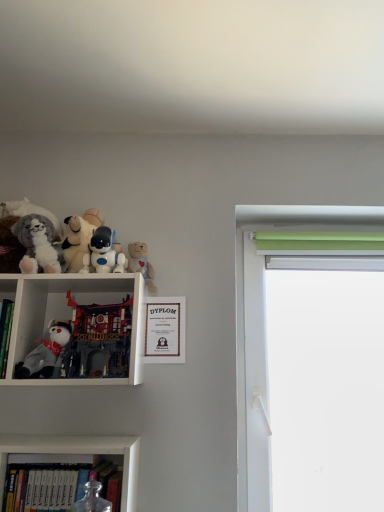
The height and width of the screenshot is (512, 384). What do you see at coordinates (45, 352) in the screenshot?
I see `white plush toy at left, the second toy positioned from the left` at bounding box center [45, 352].

Locate an element on the screen. white matte robot at upper left, arranged as the fifth toy when viewed from the left is located at coordinates (103, 253).

Describe the element at coordinates (141, 264) in the screenshot. This screenshot has width=384, height=512. I see `white plush bear at upper center, positioned as the sixth toy in left-to-right order` at that location.

This screenshot has height=512, width=384. What do you see at coordinates (98, 340) in the screenshot?
I see `matte red and black castle at left, which appears as the 4th toy when viewed from the left` at bounding box center [98, 340].

This screenshot has height=512, width=384. Identify the location of matte red and black castle at left, which appears as the 4th toy when viewed from the left. (98, 340).

Locate an element on the screen. This screenshot has height=512, width=384. fluffy plush cat at left, which appears as the 1th toy when viewed from the left is located at coordinates 39,245.

In terms of width, does white plush toy at left, the second toy positioned from the left, look wider or thinner when compared to white matte robot at upper left, the 2th toy in the right-to-left sequence?

In the image, white plush toy at left, the second toy positioned from the left, appears to be wider than white matte robot at upper left, the 2th toy in the right-to-left sequence.

Is white plush toy at left, which is the fifth toy from right to left, oriented towards white matte robot at upper left, arranged as the fifth toy when viewed from the left?

No, white plush toy at left, which is the fifth toy from right to left, is not turned towards white matte robot at upper left, arranged as the fifth toy when viewed from the left.

From a real-world perspective, is white plush toy at left, the second toy positioned from the left, under white matte robot at upper left, the 2th toy in the right-to-left sequence?

Indeed, from a real-world perspective, white plush toy at left, the second toy positioned from the left, is positioned beneath white matte robot at upper left, the 2th toy in the right-to-left sequence.

Can you confirm if white plush toy at left, the second toy positioned from the left, is smaller than white matte robot at upper left, the 2th toy in the right-to-left sequence?

Actually, white plush toy at left, the second toy positioned from the left, might be larger than white matte robot at upper left, the 2th toy in the right-to-left sequence.

Is matte gold picture frame at center outside of white plush toy at left, acting as the third toy starting from the left?

Yes, matte gold picture frame at center is located beyond the bounds of white plush toy at left, acting as the third toy starting from the left.

Is matte gold picture frame at center beside white plush toy at left, which appears as the fourth toy when viewed from the right?

They are not placed beside each other.

Is matte gold picture frame at center smaller than white plush toy at left, which appears as the fourth toy when viewed from the right?

Yes, matte gold picture frame at center is smaller than white plush toy at left, which appears as the fourth toy when viewed from the right.

Does matte gold picture frame at center have a greater height compared to white plush toy at left, which appears as the fourth toy when viewed from the right?

No, matte gold picture frame at center is not taller than white plush toy at left, which appears as the fourth toy when viewed from the right.

Which object is further away from the camera taking this photo, white plush toy at left, acting as the third toy starting from the left, or matte gold picture frame at center?

Positioned behind is matte gold picture frame at center.

Where is `picture frame below the white plush toy at left, acting as the third toy starting from the left (from a real-world perspective)`? Image resolution: width=384 pixels, height=512 pixels. picture frame below the white plush toy at left, acting as the third toy starting from the left (from a real-world perspective) is located at coordinates (165, 330).

From a real-world perspective, is white plush toy at left, acting as the third toy starting from the left, physically above matte gold picture frame at center?

Yes, from a real-world perspective, white plush toy at left, acting as the third toy starting from the left, is on top of matte gold picture frame at center.

Where is `the 1st toy to the right when counting from the white matte bookcase at left, the 2th bookcase when ordered from bottom to top`? This screenshot has width=384, height=512. the 1st toy to the right when counting from the white matte bookcase at left, the 2th bookcase when ordered from bottom to top is located at coordinates (79, 238).

Is white plush toy at left, acting as the third toy starting from the left, aimed at white matte bookcase at left, the 2th bookcase when ordered from bottom to top?

No, white plush toy at left, acting as the third toy starting from the left, is not oriented towards white matte bookcase at left, the 2th bookcase when ordered from bottom to top.

Between white plush toy at left, acting as the third toy starting from the left, and white matte bookcase at left, the 2th bookcase when ordered from bottom to top, which one has larger width?

With larger width is white matte bookcase at left, the 2th bookcase when ordered from bottom to top.

Does white plush toy at left, which appears as the fourth toy when viewed from the right, appear on the left side of white matte bookcase at left, the 2th bookcase when ordered from bottom to top?

In fact, white plush toy at left, which appears as the fourth toy when viewed from the right, is to the right of white matte bookcase at left, the 2th bookcase when ordered from bottom to top.

Would you consider matte gold picture frame at center to be distant from matte red and black castle at left, acting as the third toy starting from the right?

No, there isn't a large distance between matte gold picture frame at center and matte red and black castle at left, acting as the third toy starting from the right.

Consider the image. In terms of width, does matte gold picture frame at center look wider or thinner when compared to matte red and black castle at left, acting as the third toy starting from the right?

Clearly, matte gold picture frame at center has less width compared to matte red and black castle at left, acting as the third toy starting from the right.

Consider the image. Could you tell me if matte gold picture frame at center is turned towards matte red and black castle at left, which appears as the 4th toy when viewed from the left?

No, matte gold picture frame at center is not aimed at matte red and black castle at left, which appears as the 4th toy when viewed from the left.

At what (x,y) coordinates should I click in order to perform the action: click on toy that is the 1st object directly below the matte gold picture frame at center (from a real-world perspective). Please return your answer as a coordinate pair (x, y). Looking at the image, I should click on (98, 340).

Is hardcover books at lower left, placed as the first bookcase when sorted from bottom to top, oriented towards white plush toy at left, which is the fifth toy from right to left?

No, hardcover books at lower left, placed as the first bookcase when sorted from bottom to top, does not turn towards white plush toy at left, which is the fifth toy from right to left.

Which is behind, hardcover books at lower left, placed as the first bookcase when sorted from bottom to top, or white plush toy at left, which is the fifth toy from right to left?

white plush toy at left, which is the fifth toy from right to left, is behind.

From the picture: Considering the sizes of objects hardcover books at lower left, the 2th bookcase in the top-to-bottom sequence, and white plush toy at left, which is the fifth toy from right to left, in the image provided, who is bigger, hardcover books at lower left, the 2th bookcase in the top-to-bottom sequence, or white plush toy at left, which is the fifth toy from right to left,?

A: hardcover books at lower left, the 2th bookcase in the top-to-bottom sequence, is bigger.

Is hardcover books at lower left, the 2th bookcase in the top-to-bottom sequence, shorter than white plush toy at left, the second toy positioned from the left?

In fact, hardcover books at lower left, the 2th bookcase in the top-to-bottom sequence, may be taller than white plush toy at left, the second toy positioned from the left.

Considering the sizes of white plush bear at upper center, positioned as the sixth toy in left-to-right order, and hardcover books at lower left, the 2th bookcase in the top-to-bottom sequence, in the image, is white plush bear at upper center, positioned as the sixth toy in left-to-right order, wider or thinner than hardcover books at lower left, the 2th bookcase in the top-to-bottom sequence,?

Clearly, white plush bear at upper center, positioned as the sixth toy in left-to-right order, has less width compared to hardcover books at lower left, the 2th bookcase in the top-to-bottom sequence.

Between white plush bear at upper center, positioned as the sixth toy in left-to-right order, and hardcover books at lower left, the 2th bookcase in the top-to-bottom sequence, which one has larger size?

hardcover books at lower left, the 2th bookcase in the top-to-bottom sequence.

From a real-world perspective, relative to hardcover books at lower left, the 2th bookcase in the top-to-bottom sequence, is white plush bear at upper center, positioned as the sixth toy in left-to-right order, vertically above or below?

From a real-world perspective, white plush bear at upper center, positioned as the sixth toy in left-to-right order, is physically above hardcover books at lower left, the 2th bookcase in the top-to-bottom sequence.

Is point (136, 267) closer to camera compared to point (61, 445)?

No, (136, 267) is behind (61, 445).

From the white plush toy at left, which is the fifth toy from right to left, count 3rd toys backward and point to it. Please provide its 2D coordinates.

[(103, 253)]

Identify the location of picture frame located on the right of white plush toy at left, acting as the third toy starting from the left. This screenshot has width=384, height=512. (165, 330).

Estimate the real-world distances between objects in this image. Which object is closer to white plush toy at left, acting as the third toy starting from the left, white plush bear at upper center, marked as the first toy in a right-to-left arrangement, or white matte bookcase at left, the 2th bookcase when ordered from bottom to top?

white plush bear at upper center, marked as the first toy in a right-to-left arrangement, lies closer to white plush toy at left, acting as the third toy starting from the left, than the other object.

When comparing their distances from white matte robot at upper left, the 2th toy in the right-to-left sequence, does green fabric at right or matte gold picture frame at center seem further?

green fabric at right is further to white matte robot at upper left, the 2th toy in the right-to-left sequence.

Which object lies nearer to the anchor point matte gold picture frame at center, fluffy plush cat at left, which appears as the 1th toy when viewed from the left, or white matte bookcase at left, placed as the first bookcase when sorted from top to bottom?

Among the two, white matte bookcase at left, placed as the first bookcase when sorted from top to bottom, is located nearer to matte gold picture frame at center.

Based on their spatial positions, is green fabric at right or white plush toy at left, acting as the third toy starting from the left, closer to white matte bookcase at left, placed as the first bookcase when sorted from top to bottom?

white plush toy at left, acting as the third toy starting from the left.

Looking at the image, which one is located closer to matte gold picture frame at center, white matte bookcase at left, placed as the first bookcase when sorted from top to bottom, or white plush toy at left, acting as the third toy starting from the left?

Based on the image, white matte bookcase at left, placed as the first bookcase when sorted from top to bottom, appears to be nearer to matte gold picture frame at center.

Estimate the real-world distances between objects in this image. Which object is closer to matte red and black castle at left, which appears as the 4th toy when viewed from the left, white plush bear at upper center, marked as the first toy in a right-to-left arrangement, or white matte bookcase at left, the 2th bookcase when ordered from bottom to top?

white matte bookcase at left, the 2th bookcase when ordered from bottom to top, is closer to matte red and black castle at left, which appears as the 4th toy when viewed from the left.

Estimate the real-world distances between objects in this image. Which object is closer to white plush bear at upper center, marked as the first toy in a right-to-left arrangement, matte red and black castle at left, acting as the third toy starting from the right, or white matte robot at upper left, the 2th toy in the right-to-left sequence?

white matte robot at upper left, the 2th toy in the right-to-left sequence, lies closer to white plush bear at upper center, marked as the first toy in a right-to-left arrangement, than the other object.

Looking at the image, which one is located closer to hardcover books at lower left, placed as the first bookcase when sorted from bottom to top, matte gold picture frame at center or green fabric at right?

matte gold picture frame at center lies closer to hardcover books at lower left, placed as the first bookcase when sorted from bottom to top, than the other object.

The width and height of the screenshot is (384, 512). What are the coordinates of `bookcase between white plush bear at upper center, marked as the first toy in a right-to-left arrangement, and matte red and black castle at left, acting as the third toy starting from the right, from top to bottom` in the screenshot? It's located at (64, 298).

What are the coordinates of `bookcase that lies between white plush bear at upper center, positioned as the sixth toy in left-to-right order, and hardcover books at lower left, placed as the first bookcase when sorted from bottom to top, from top to bottom` in the screenshot? It's located at (64, 298).

Find the location of `bookcase between white matte robot at upper left, the 2th toy in the right-to-left sequence, and matte red and black castle at left, acting as the third toy starting from the right, in the vertical direction`. bookcase between white matte robot at upper left, the 2th toy in the right-to-left sequence, and matte red and black castle at left, acting as the third toy starting from the right, in the vertical direction is located at coordinates (64, 298).

Identify the location of bookcase between white matte robot at upper left, the 2th toy in the right-to-left sequence, and hardcover books at lower left, the 2th bookcase in the top-to-bottom sequence, in the vertical direction. (64, 298).